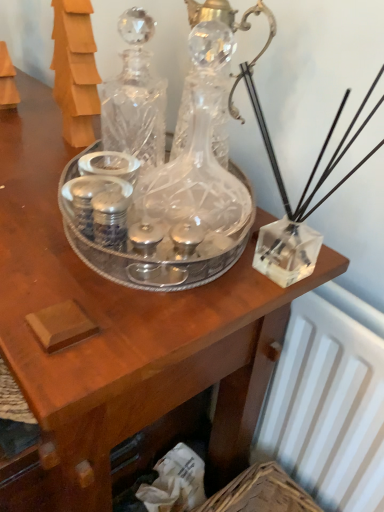
Question: In which direction should I rotate to look at transparent crystal decanter at center, which ranks as the 1th glass bottle in front-to-back order?

Choices:
 (A) right
 (B) left

Answer: (A)

Question: Does clear crystal decanter at center, which appears as the 2th glass bottle when viewed from the front, have a larger size compared to transparent crystal decanter at center, which appears as the second glass bottle when viewed from the back?

Choices:
 (A) no
 (B) yes

Answer: (A)

Question: Is clear crystal decanter at center, positioned as the first glass bottle in back-to-front order, not inside transparent crystal decanter at center, which appears as the second glass bottle when viewed from the back?

Choices:
 (A) no
 (B) yes

Answer: (B)

Question: Is clear crystal decanter at center, positioned as the first glass bottle in back-to-front order, closer to camera compared to transparent crystal decanter at center, which appears as the second glass bottle when viewed from the back?

Choices:
 (A) no
 (B) yes

Answer: (A)

Question: Considering the relative sizes of clear crystal decanter at center, which appears as the 2th glass bottle when viewed from the front, and transparent crystal decanter at center, which ranks as the 1th glass bottle in front-to-back order, in the image provided, is clear crystal decanter at center, which appears as the 2th glass bottle when viewed from the front, smaller than transparent crystal decanter at center, which ranks as the 1th glass bottle in front-to-back order,?

Choices:
 (A) yes
 (B) no

Answer: (A)

Question: From the image's perspective, does clear crystal decanter at center, positioned as the first glass bottle in back-to-front order, appear higher than transparent crystal decanter at center, which appears as the second glass bottle when viewed from the back?

Choices:
 (A) yes
 (B) no

Answer: (A)

Question: Is clear crystal decanter at center, positioned as the first glass bottle in back-to-front order, next to transparent crystal decanter at center, which ranks as the 1th glass bottle in front-to-back order, and touching it?

Choices:
 (A) yes
 (B) no

Answer: (B)

Question: From the image's perspective, is transparent crystal decanter at center, which ranks as the 1th glass bottle in front-to-back order, beneath clear crystal decanter at center, which appears as the 2th glass bottle when viewed from the front?

Choices:
 (A) no
 (B) yes

Answer: (B)

Question: Does transparent crystal decanter at center, which ranks as the 1th glass bottle in front-to-back order, appear on the right side of clear crystal decanter at center, positioned as the first glass bottle in back-to-front order?

Choices:
 (A) yes
 (B) no

Answer: (A)

Question: From a real-world perspective, is transparent crystal decanter at center, which ranks as the 1th glass bottle in front-to-back order, physically below clear crystal decanter at center, positioned as the first glass bottle in back-to-front order?

Choices:
 (A) no
 (B) yes

Answer: (B)

Question: From the image's perspective, is transparent crystal decanter at center, which appears as the second glass bottle when viewed from the back, on top of clear crystal decanter at center, which appears as the 2th glass bottle when viewed from the front?

Choices:
 (A) yes
 (B) no

Answer: (B)

Question: Considering the relative sizes of transparent crystal decanter at center, which ranks as the 1th glass bottle in front-to-back order, and clear crystal decanter at center, positioned as the first glass bottle in back-to-front order, in the image provided, is transparent crystal decanter at center, which ranks as the 1th glass bottle in front-to-back order, shorter than clear crystal decanter at center, positioned as the first glass bottle in back-to-front order,?

Choices:
 (A) yes
 (B) no

Answer: (B)

Question: Can you confirm if transparent crystal decanter at center, which ranks as the 1th glass bottle in front-to-back order, is smaller than clear crystal decanter at center, positioned as the first glass bottle in back-to-front order?

Choices:
 (A) yes
 (B) no

Answer: (B)

Question: From a real-world perspective, is clear crystal decanter at center, positioned as the first glass bottle in back-to-front order, physically located above or below transparent crystal decanter at center, which ranks as the 1th glass bottle in front-to-back order?

Choices:
 (A) below
 (B) above

Answer: (B)